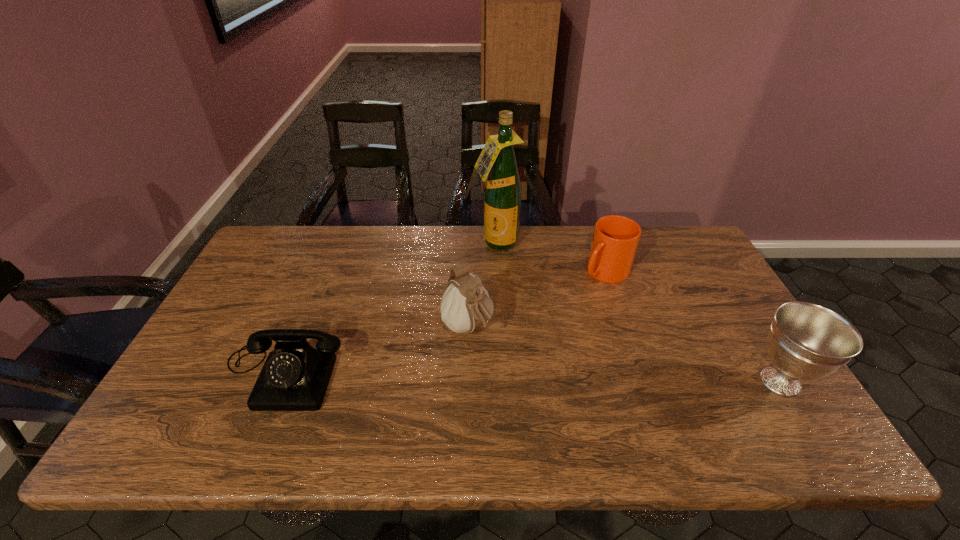
Where is `telephone present at the near edge`? Image resolution: width=960 pixels, height=540 pixels. telephone present at the near edge is located at coordinates (295, 376).

Identify the location of chalice positioned at the near edge. (806, 341).

Where is `object that is at the left edge`? Image resolution: width=960 pixels, height=540 pixels. object that is at the left edge is located at coordinates (295, 376).

You are a GUI agent. You are given a task and a screenshot of the screen. Output one action in this format:
    pyautogui.click(x=<x>, y=<y>)
    Task: Click on the object at the right edge
    The image size is (960, 540).
    Given the screenshot: What is the action you would take?
    pyautogui.click(x=806, y=341)

Find the location of `object that is at the near left corner`. object that is at the near left corner is located at coordinates (295, 376).

I want to click on object located in the near right corner section of the desktop, so click(806, 341).

This screenshot has height=540, width=960. I want to click on vacant space at the far edge of the desktop, so click(x=545, y=226).

The width and height of the screenshot is (960, 540). Find the location of `blank space at the near edge`. blank space at the near edge is located at coordinates (540, 401).

In the image, there is a desktop. At what (x,y) coordinates should I click in order to perform the action: click on vacant space at the left edge. Please return your answer as a coordinate pair (x, y). Looking at the image, I should click on (244, 297).

Image resolution: width=960 pixels, height=540 pixels. In order to click on vacant region at the far left corner in this screenshot , I will do 318,226.